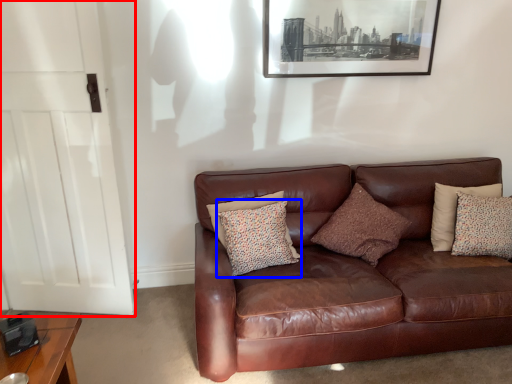
Question: Which object is further to the camera taking this photo, door (highlighted by a red box) or pillow (highlighted by a blue box)?

Choices:
 (A) door
 (B) pillow

Answer: (B)